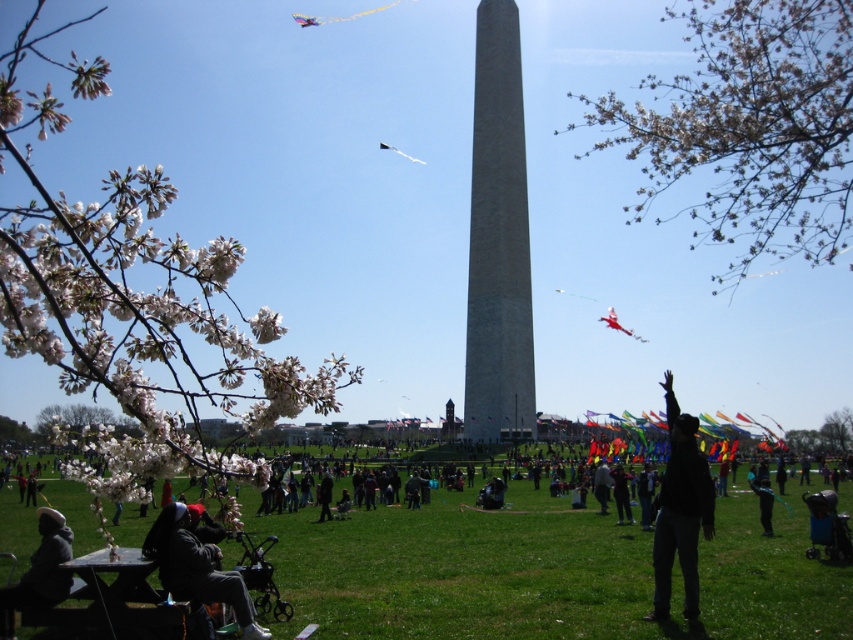
Question: Considering the real-world distances, which object is closest to the dark gray hoodie at lower left?

Choices:
 (A) gray stone obelisk at center
 (B) black matte person at center

Answer: (B)

Question: Among these points, which one is farthest from the camera?

Choices:
 (A) (305, 17)
 (B) (54, 577)
 (C) (610, 326)

Answer: (A)

Question: Does green grassy field at lower center appear under dark gray jacket at lower left?

Choices:
 (A) yes
 (B) no

Answer: (A)

Question: Estimate the real-world distances between objects in this image. Which object is closer to the translucent white kite at center?

Choices:
 (A) gray stone obelisk at center
 (B) shiny red kite at center

Answer: (A)

Question: Is dark gray jacket at lower left smaller than translucent white kite at center?

Choices:
 (A) yes
 (B) no

Answer: (B)

Question: Does gray stone obelisk at center appear over black matte person at center?

Choices:
 (A) no
 (B) yes

Answer: (B)